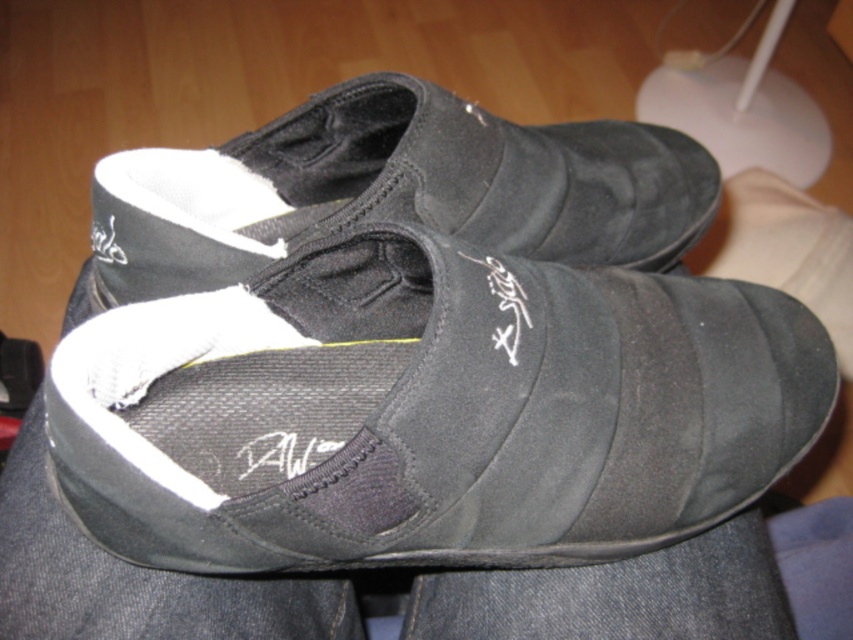
Does suede/black slip-on shoe at center have a greater width compared to black suede shoe at center?

Incorrect, suede/black slip-on shoe at center's width does not surpass black suede shoe at center's.

Can you confirm if suede/black slip-on shoe at center is positioned to the right of black suede shoe at center?

Indeed, suede/black slip-on shoe at center is positioned on the right side of black suede shoe at center.

Find the location of a particular element. The height and width of the screenshot is (640, 853). suede/black slip-on shoe at center is located at coordinates (430, 412).